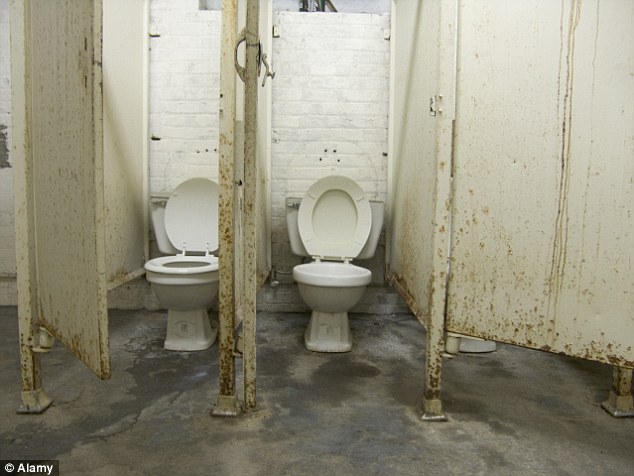
The height and width of the screenshot is (476, 634). What are the coordinates of `toilet` in the screenshot? It's located at (191, 291), (327, 293).